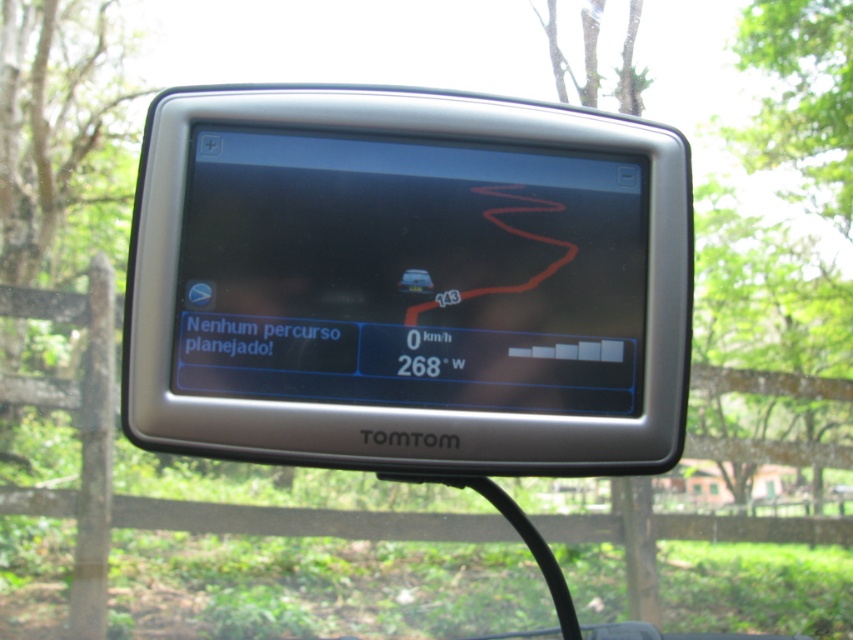
You are driving a matte black car at center and want to check your GPS. Is the silver plastic gps at center placed in a position where you can easily see it while driving?

The silver plastic gps at center is positioned over matte black car at center, so it is likely mounted on the dashboard in a position where you can easily see it while driving.

You are a driver who needs to check the width of the silver plastic gps at center and the matte black car at center. According to the image, which object is wider?

The silver plastic gps at center is wider than the matte black car at center.